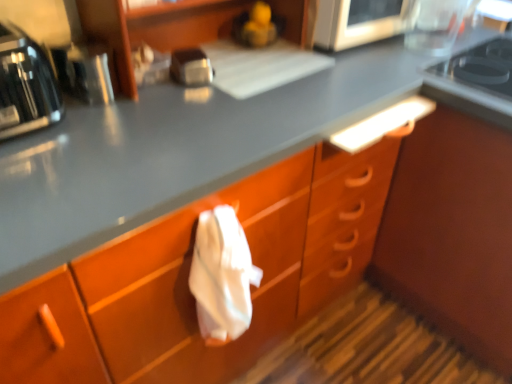
Where is `free location in front of satin silver toaster at upper center`? free location in front of satin silver toaster at upper center is located at coordinates (184, 109).